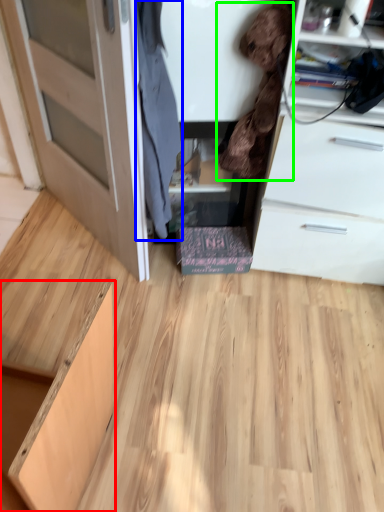
Question: Which is nearer to the cabinetry (highlighted by a red box)? clothing (highlighted by a blue box) or clothing (highlighted by a green box).

Choices:
 (A) clothing
 (B) clothing

Answer: (A)